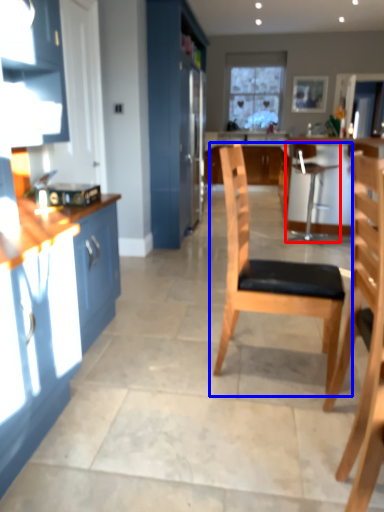
Question: Which point is further to the camera, chair (highlighted by a red box) or chair (highlighted by a blue box)?

Choices:
 (A) chair
 (B) chair

Answer: (A)